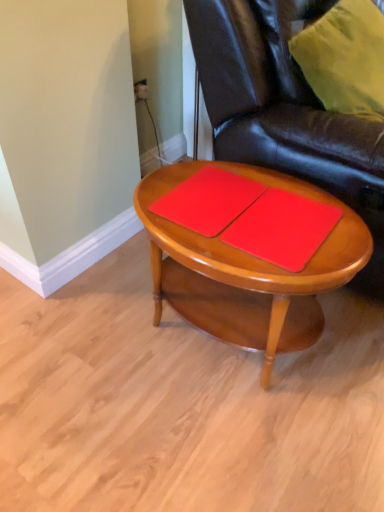
Question: Considering the relative positions of red matte notebook at center, acting as the 2th notebook starting from the left, and matte wood coffee table at center in the image provided, is red matte notebook at center, acting as the 2th notebook starting from the left, to the left or to the right of matte wood coffee table at center?

Choices:
 (A) left
 (B) right

Answer: (B)

Question: Considering their positions, is red matte notebook at center, which appears as the first notebook when viewed from the right, located in front of or behind matte wood coffee table at center?

Choices:
 (A) front
 (B) behind

Answer: (B)

Question: Estimate the real-world distances between objects in this image. Which object is closer to the matte red notebook at center, which is the 2th notebook in right-to-left order?

Choices:
 (A) red matte notebook at center, which appears as the first notebook when viewed from the right
 (B) matte wood coffee table at center
 (C) glossy leather chair at center

Answer: (A)

Question: Which object is the closest to the red matte notebook at center, acting as the 2th notebook starting from the left?

Choices:
 (A) glossy leather chair at center
 (B) matte red notebook at center, the 1th notebook from the left
 (C) matte wood coffee table at center

Answer: (C)